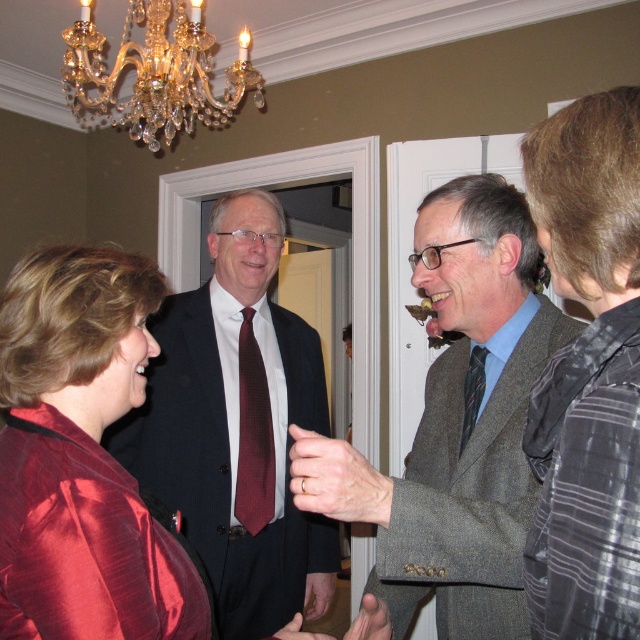
You are organizing a photo shoot and need to position the textured brown suit at center and the gray striped shirt at right in a narrow hallway. Based on their widths, which one should you place closer to the wall to ensure both can fit comfortably?

The textured brown suit at center is wider than the gray striped shirt at right, so you should place the textured brown suit at center closer to the wall to accommodate its width, allowing the gray striped shirt at right to fit alongside without overcrowding.

You are at the social gathering and want to take a photo of both point [392,484] and point [472,426] in the image. Which point should you focus on first to ensure both are in focus?

You should focus on point [392,484] first because it is closer to the camera than point [472,426], ensuring both will be in focus when using a camera with a fixed focal plane.